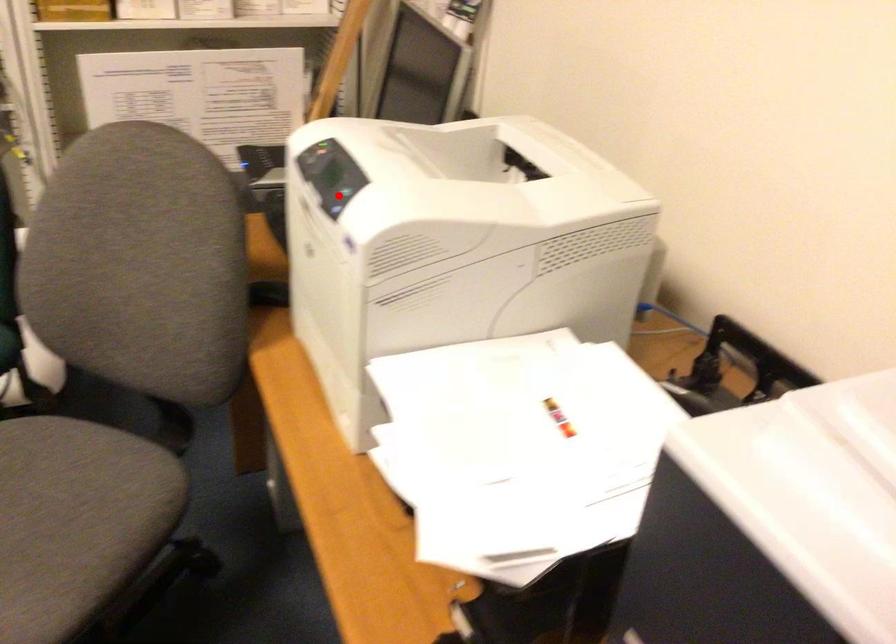
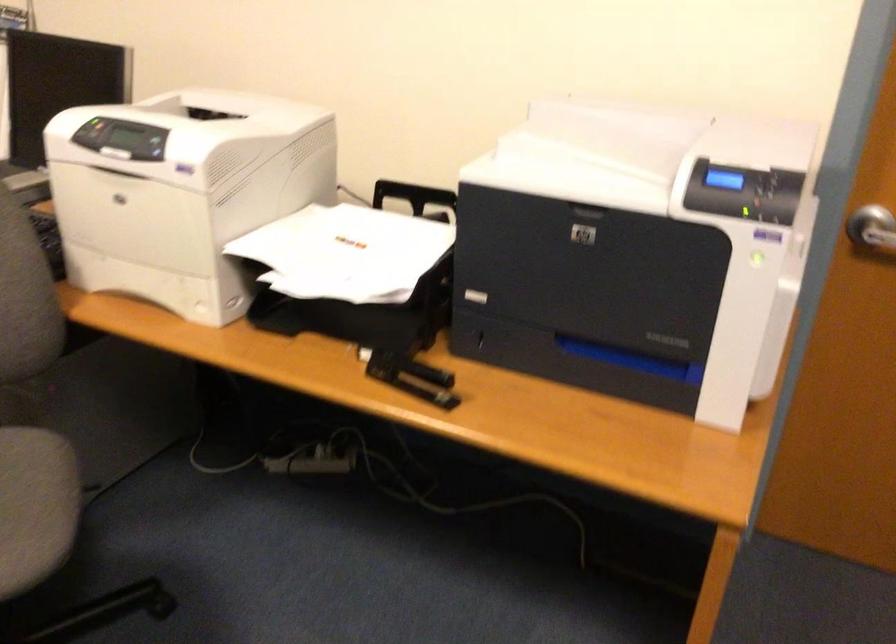
The point at the highlighted location is marked in the first image. Where is the corresponding point in the second image?

(151, 144)